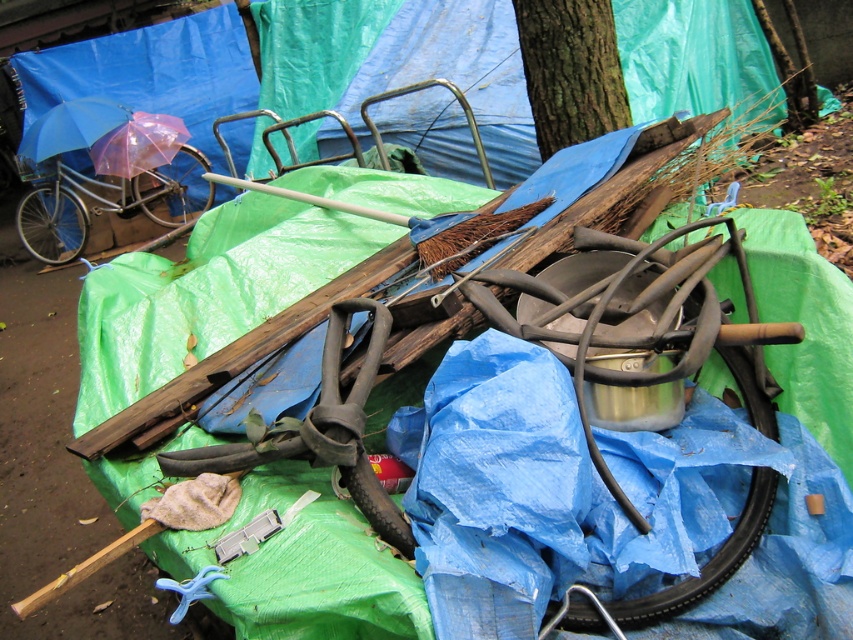
Question: Among these objects, which one is nearest to the camera?

Choices:
 (A) transparent plastic umbrella at upper left
 (B) blue matte umbrella at upper left

Answer: (B)

Question: Is transparent plastic umbrella at upper left positioned at the back of blue matte umbrella at upper left?

Choices:
 (A) no
 (B) yes

Answer: (B)

Question: Is transparent plastic umbrella at upper left in front of blue matte umbrella at upper left?

Choices:
 (A) yes
 (B) no

Answer: (B)

Question: Which point appears farthest from the camera in this image?

Choices:
 (A) (132, 160)
 (B) (61, 120)

Answer: (A)

Question: Does transparent plastic umbrella at upper left appear under blue matte umbrella at upper left?

Choices:
 (A) yes
 (B) no

Answer: (A)